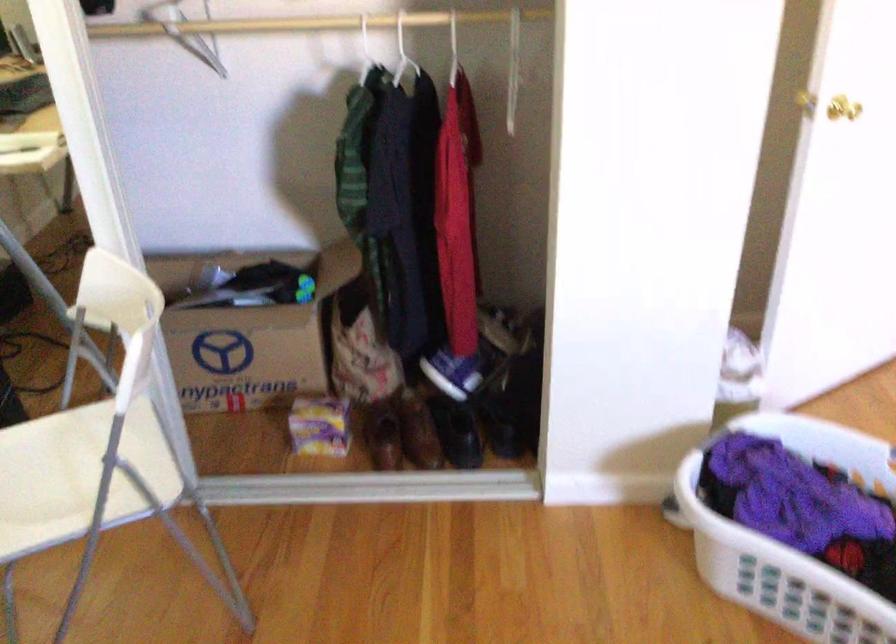
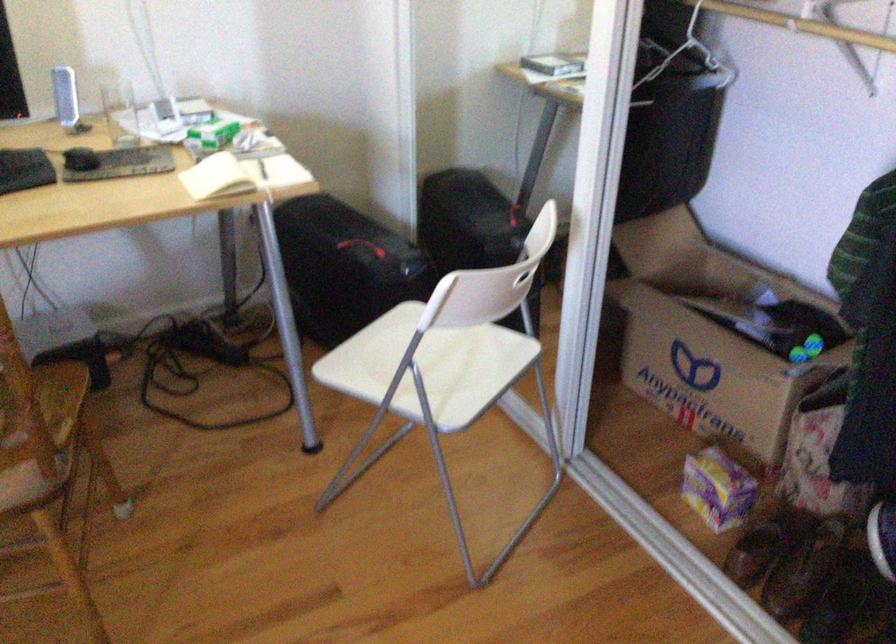
The point at (x=248, y=310) is marked in the first image. Where is the corresponding point in the second image?

(708, 336)